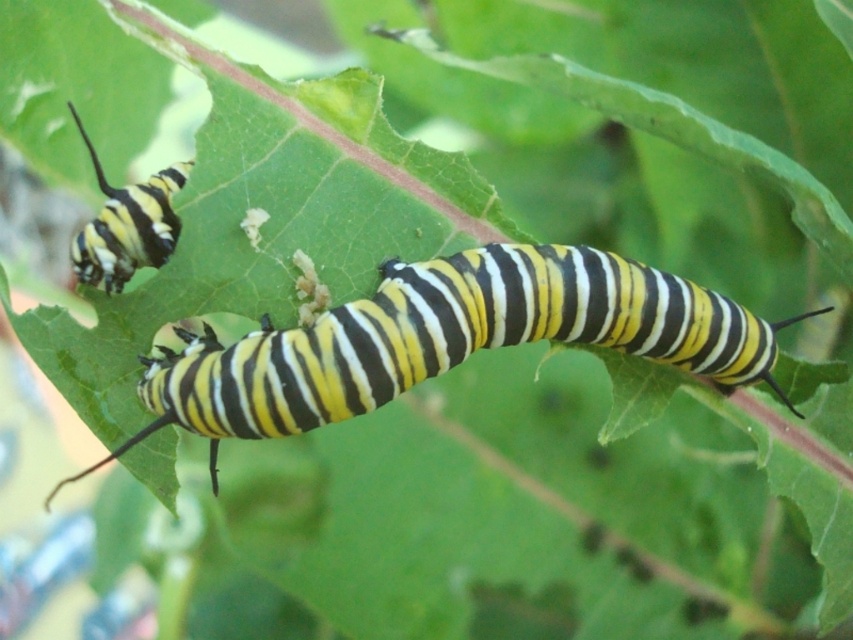
You are a biologist observing two points on a leaf where monarch caterpillars are feeding. The points are labeled as point 1 at coordinates (233,376) and point 2 at coordinates (115,252). Based on your observation, which point is closer to the viewer?

Point 1 at coordinates (233,376) is closer to the viewer because it is in front of point 2 at coordinates (115,252).